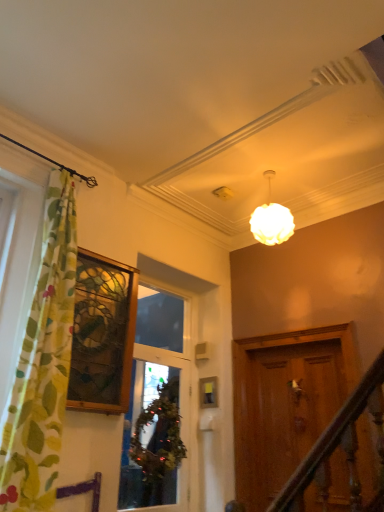
Question: From the image's perspective, is green leafy wreath at center positioned above or below green fabric wreath at center, which is the 2th window in left-to-right order?

Choices:
 (A) above
 (B) below

Answer: (B)

Question: From their relative heights in the image, would you say green leafy wreath at center is taller or shorter than green fabric wreath at center, which is the 2th window in left-to-right order?

Choices:
 (A) short
 (B) tall

Answer: (A)

Question: Which object is the closest to the green fabric wreath at center, which is the 2th window in left-to-right order?

Choices:
 (A) stained glass window at left, which is the second window from right to left
 (B) matte white globe at upper center
 (C) green leafy wreath at center
 (D) green floral fabric curtain at left

Answer: (C)

Question: Estimate the real-world distances between objects in this image. Which object is farther from the stained glass window at left, which is the second window from right to left?

Choices:
 (A) green leafy wreath at center
 (B) green fabric wreath at center, which is the 2th window in left-to-right order
 (C) green floral fabric curtain at left
 (D) matte white globe at upper center

Answer: (D)